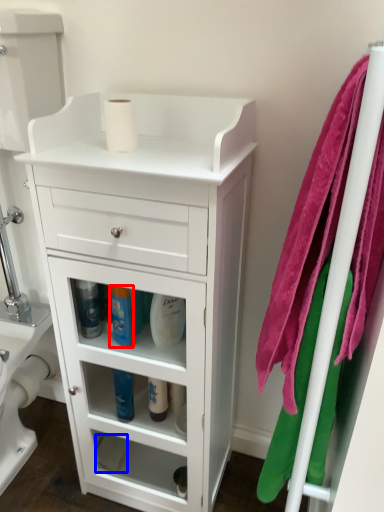
Question: Which object is closer to the camera taking this photo, cleaning product (highlighted by a red box) or toilet paper (highlighted by a blue box)?

Choices:
 (A) cleaning product
 (B) toilet paper

Answer: (A)